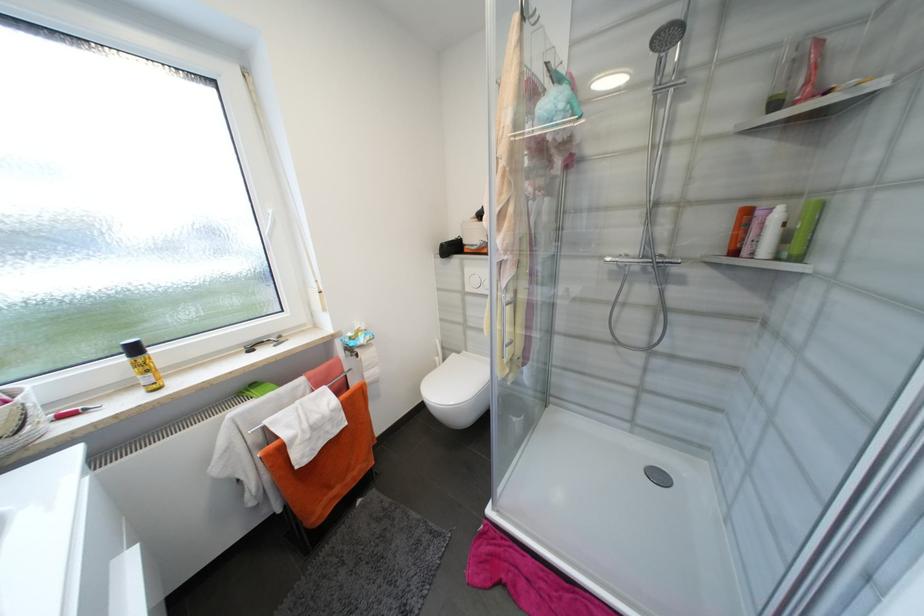
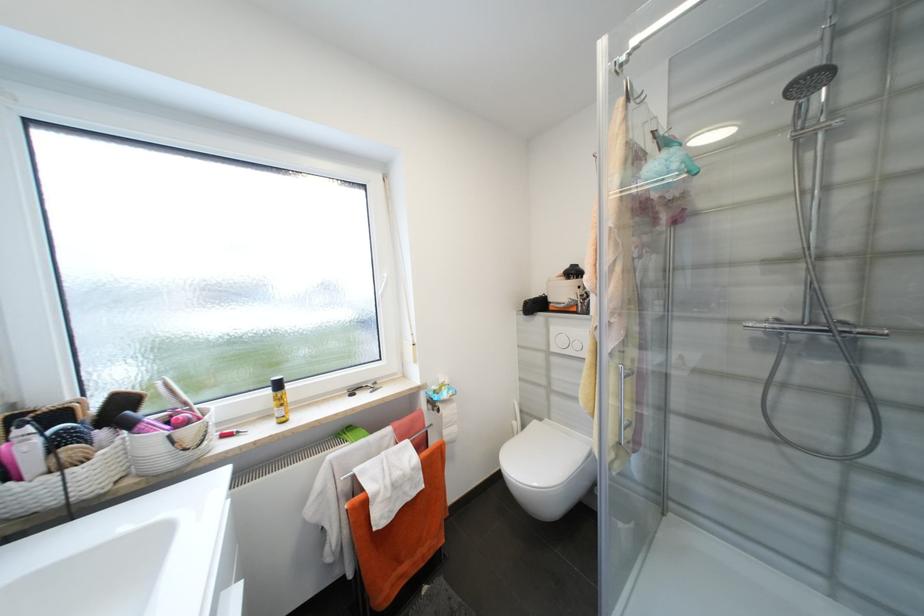
Where in the second image is the point corresponding to pixel 514 377 from the first image?

(618, 463)